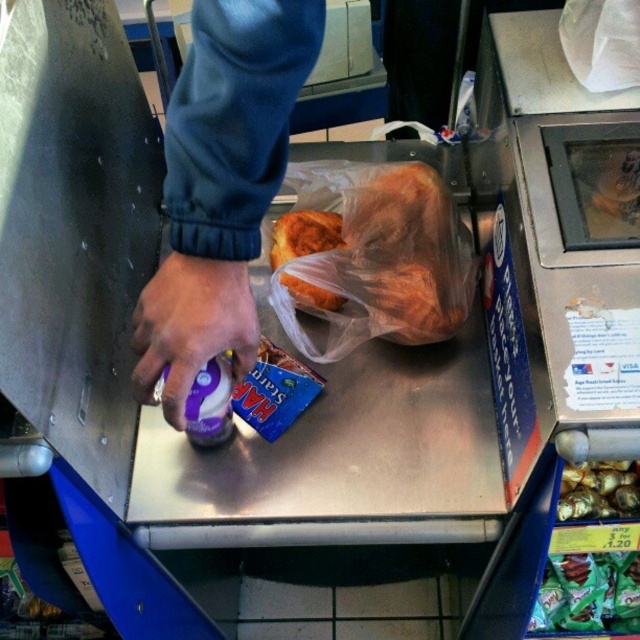
You are a cashier at the checkout counter. You have a golden brown bread at center and a blue package next to it. Which one is closer to the checkout scale?

The golden brown bread at center is closer to the checkout scale than the blue package next to it since they are 31.24 inches apart.

You are a cashier at the store and need to place the green matte candy at lower right and the shiny gold foil at center into a customer bag. Considering their sizes, which item should you place first to ensure the bag can hold both?

The green matte candy at lower right has a smaller size compared to the shiny gold foil at center. Therefore, you should place the shiny gold foil at center first into the bag to ensure it fits properly before adding the smaller green matte candy at lower right.